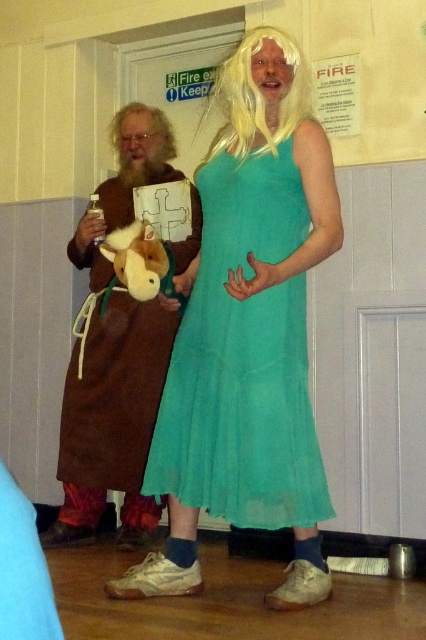
You are standing in front of the scene and want to locate the brown leather robe at left. What are its coordinates?

The brown leather robe at left is located at coordinates 0.553 on the x axis and 0.272 on the y axis.

You are a stagehand preparing for a play and need to place two blonde synthetic wigs on a shelf. The shelf has a width of 36 inches. If you place the blonde synthetic wig at center and the blonde synthetic wig at upper left on the shelf, will they fit side by side without overlapping?

The distance between the blonde synthetic wig at center and the blonde synthetic wig at upper left is 35.26 inches, which is less than the shelf width of 36 inches. Therefore, they can fit side by side without overlapping.

You are an observer standing in front of the two performers. Which of the two points, point (86, 524) or point (112, 134), is closer to you?

Point (86, 524) is closer to the viewer than point (112, 134).